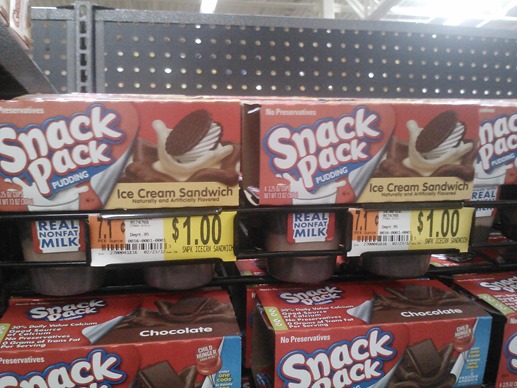
In order to click on ceiling in this screenshot , I will do `click(258, 6)`.